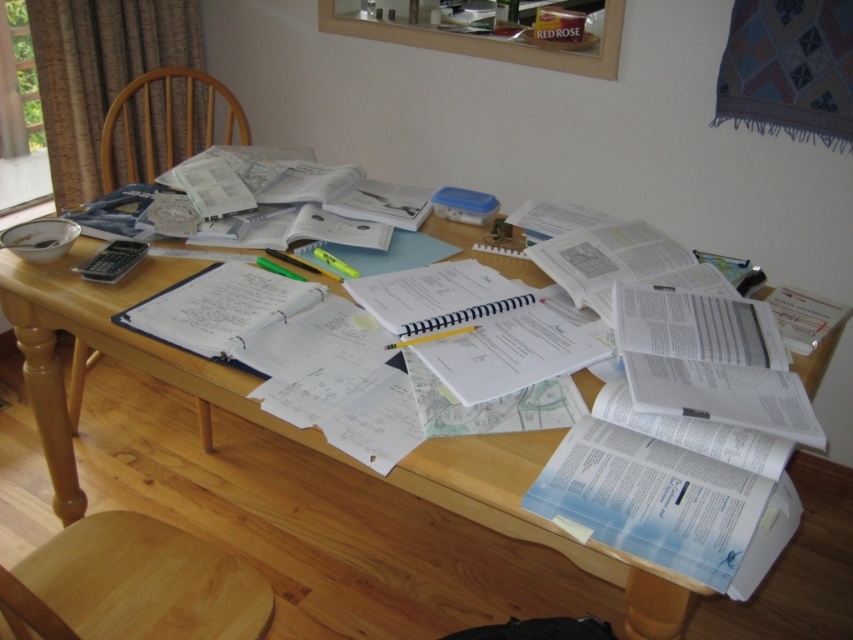
Who is more forward, [245,602] or [184,140]?

Point [245,602] is more forward.

Who is shorter, light brown wood chair at lower left or wooden chair at left?

Standing shorter between the two is light brown wood chair at lower left.

Who is more distant from viewer, (79, 636) or (106, 177)?

The point (106, 177) is behind.

Locate an element on the screen. This screenshot has height=640, width=853. light brown wood chair at lower left is located at coordinates (134, 584).